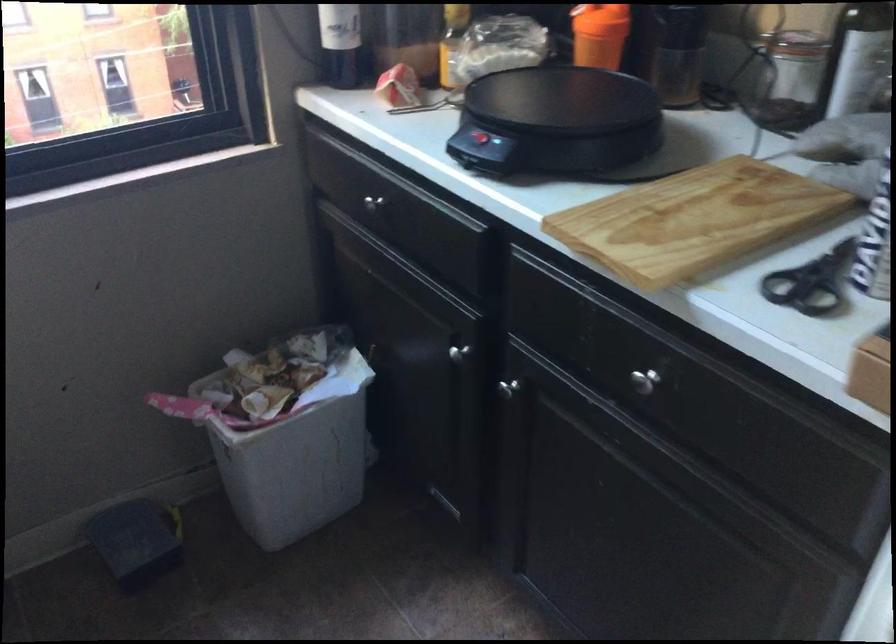
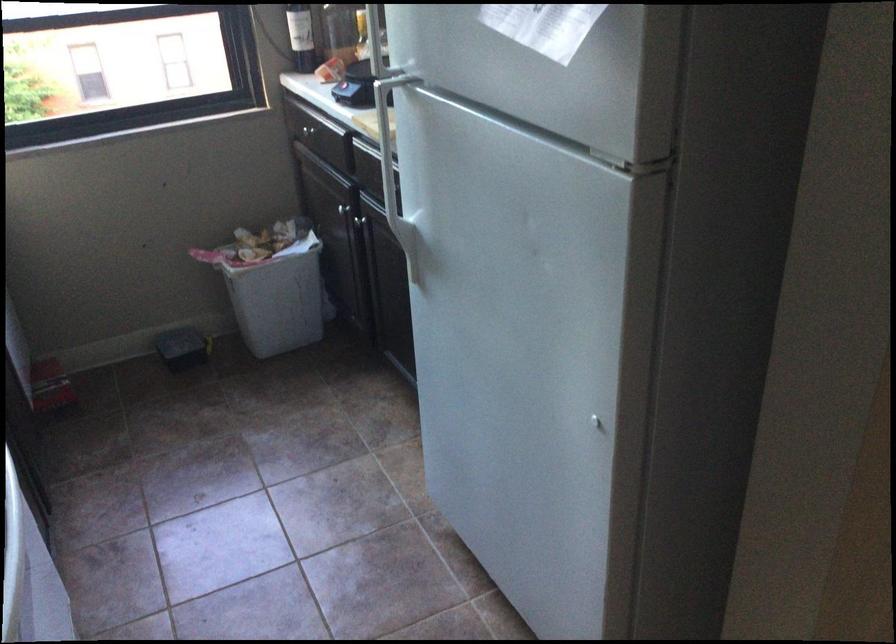
Question: I am providing you with two images of the same scene from different viewpoints. Which of the following objects are not visible in image2?

Choices:
 (A) wine bottle
 (B) white trash can
 (C) wooden cutting board
 (D) paper tissue box

Answer: (C)